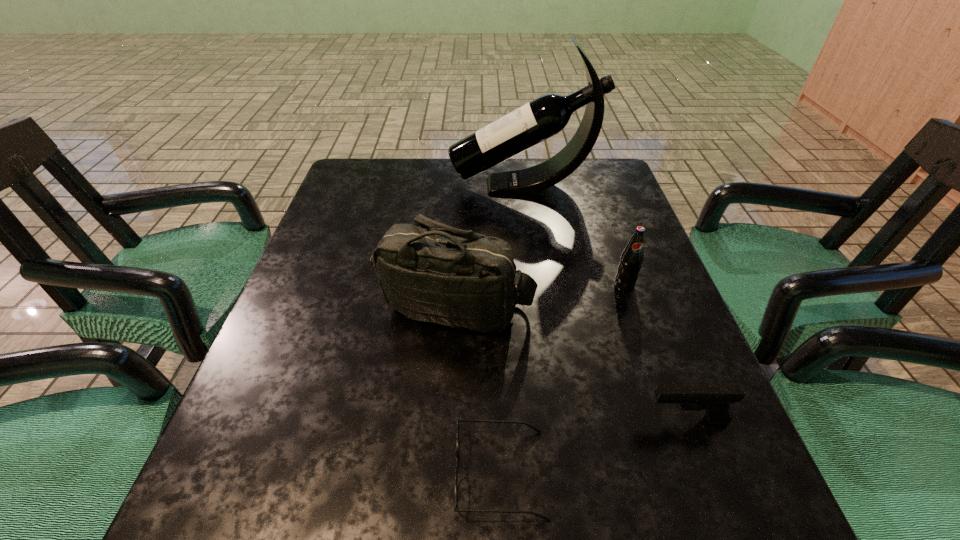
Image resolution: width=960 pixels, height=540 pixels. I want to click on object positioned at the near edge, so click(459, 420).

You are a GUI agent. You are given a task and a screenshot of the screen. Output one action in this format:
    pyautogui.click(x=<x>, y=<y>)
    Task: Click on the wine bottle at the right edge
    Image resolution: width=960 pixels, height=540 pixels.
    Given the screenshot: What is the action you would take?
    pyautogui.click(x=547, y=115)

This screenshot has width=960, height=540. Identify the location of pop positioned at the right edge. (632, 257).

Locate an element on the screen. This screenshot has width=960, height=540. pistol situated at the right edge is located at coordinates pos(715,399).

You are a GUI agent. You are given a task and a screenshot of the screen. Output one action in this format:
    pyautogui.click(x=<x>, y=<y>)
    Task: Click on the object that is at the far right corner
    The width and height of the screenshot is (960, 540).
    Given the screenshot: What is the action you would take?
    pyautogui.click(x=547, y=115)

This screenshot has height=540, width=960. What are the coordinates of `vacant area at the far edge` in the screenshot? It's located at (415, 161).

The image size is (960, 540). Identify the location of vacant space at the left edge. (287, 298).

Where is `vacant space at the right edge of the desktop`? The width and height of the screenshot is (960, 540). vacant space at the right edge of the desktop is located at coordinates pos(608,230).

Locate an element on the screen. free region at the far right corner of the desktop is located at coordinates (628, 199).

Locate an element on the screen. vacant space that is in between the pop and the nearest object is located at coordinates (563, 380).